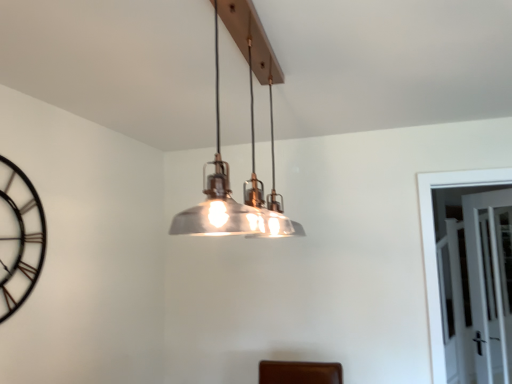
The image size is (512, 384). In order to click on metallic/textured pendant light at center in this screenshot , I will do `click(231, 191)`.

Where is `clear glass door at right`? The width and height of the screenshot is (512, 384). clear glass door at right is located at coordinates (489, 283).

The height and width of the screenshot is (384, 512). What are the coordinates of `black metal clock at left` in the screenshot? It's located at 19,238.

What is the approximate height of black metal clock at left?

black metal clock at left is 28.31 inches in height.

Find the location of a particular element. Image resolution: width=512 pixels, height=384 pixels. metallic/textured pendant light at center is located at coordinates (231, 191).

Which object is wider, black metal clock at left or clear glass door at right?

clear glass door at right.

Between point (22, 185) and point (489, 317), which one is positioned behind?

The point (489, 317) is behind.

Who is taller, black metal clock at left or clear glass door at right?

clear glass door at right.

Would you say black metal clock at left contains clear glass door at right?

No, clear glass door at right is located outside of black metal clock at left.

Find the location of `lamp above the clear glass door at right (from the image's perspective)`. lamp above the clear glass door at right (from the image's perspective) is located at coordinates (231, 191).

Which object is positioned more to the left, metallic/textured pendant light at center or clear glass door at right?

Positioned to the left is metallic/textured pendant light at center.

Do you think metallic/textured pendant light at center is within clear glass door at right, or outside of it?

metallic/textured pendant light at center cannot be found inside clear glass door at right.

Does point (223, 184) lie behind point (484, 248)?

That is False.

Could metallic/textured pendant light at center be considered to be inside black metal clock at left?

No, metallic/textured pendant light at center is not inside black metal clock at left.

In terms of width, does black metal clock at left look wider or thinner when compared to metallic/textured pendant light at center?

Clearly, black metal clock at left has less width compared to metallic/textured pendant light at center.

Can you confirm if black metal clock at left is shorter than metallic/textured pendant light at center?

In fact, black metal clock at left may be taller than metallic/textured pendant light at center.

Which object is positioned more to the left, black metal clock at left or metallic/textured pendant light at center?

From the viewer's perspective, black metal clock at left appears more on the left side.

Which object is positioned more to the left, metallic/textured pendant light at center or black metal clock at left?

Positioned to the left is black metal clock at left.

Is metallic/textured pendant light at center not inside black metal clock at left?

Yes, metallic/textured pendant light at center is not within black metal clock at left.

Considering the positions of objects metallic/textured pendant light at center and black metal clock at left in the image provided, who is in front, metallic/textured pendant light at center or black metal clock at left?

metallic/textured pendant light at center.

From the image's perspective, is clear glass door at right above or below black metal clock at left?

clear glass door at right is below black metal clock at left.

From a real-world perspective, is clear glass door at right physically located above or below black metal clock at left?

clear glass door at right is situated lower than black metal clock at left in the real world.

Would you consider clear glass door at right to be distant from black metal clock at left?

Yes, clear glass door at right is far from black metal clock at left.

Considering the points (498, 210) and (0, 244), which point is in front, point (498, 210) or point (0, 244)?

The point (0, 244) is more forward.

Is clear glass door at right to the left of metallic/textured pendant light at center from the viewer's perspective?

No.

Can you tell me how much clear glass door at right and metallic/textured pendant light at center differ in facing direction?

The facing directions of clear glass door at right and metallic/textured pendant light at center are 147 degrees apart.

From a real-world perspective, who is located higher, clear glass door at right or metallic/textured pendant light at center?

metallic/textured pendant light at center is physically above.

Is clear glass door at right completely or partially outside of metallic/textured pendant light at center?

Absolutely, clear glass door at right is external to metallic/textured pendant light at center.

Where is `glass door that is on the right side of black metal clock at left`? The width and height of the screenshot is (512, 384). glass door that is on the right side of black metal clock at left is located at coordinates (489, 283).

The height and width of the screenshot is (384, 512). I want to click on lamp that is in front of the clear glass door at right, so click(x=231, y=191).

Based on their spatial positions, is clear glass door at right or metallic/textured pendant light at center further from black metal clock at left?

Based on the image, clear glass door at right appears to be further to black metal clock at left.

When comparing their distances from metallic/textured pendant light at center, does clear glass door at right or black metal clock at left seem closer?

Based on the image, black metal clock at left appears to be nearer to metallic/textured pendant light at center.

Looking at the image, which one is located further to clear glass door at right, metallic/textured pendant light at center or black metal clock at left?

Among the two, black metal clock at left is located further to clear glass door at right.

Considering their positions, is black metal clock at left positioned further to clear glass door at right than metallic/textured pendant light at center?

black metal clock at left.

Based on the photo, which object lies nearer to the anchor point black metal clock at left, metallic/textured pendant light at center or clear glass door at right?

Among the two, metallic/textured pendant light at center is located nearer to black metal clock at left.

Based on their spatial positions, is black metal clock at left or clear glass door at right closer to metallic/textured pendant light at center?

black metal clock at left is positioned closer to the anchor metallic/textured pendant light at center.

At what (x,y) coordinates should I click in order to perform the action: click on lamp located between black metal clock at left and clear glass door at right in the left-right direction. Please return your answer as a coordinate pair (x, y). This screenshot has height=384, width=512. Looking at the image, I should click on (231, 191).